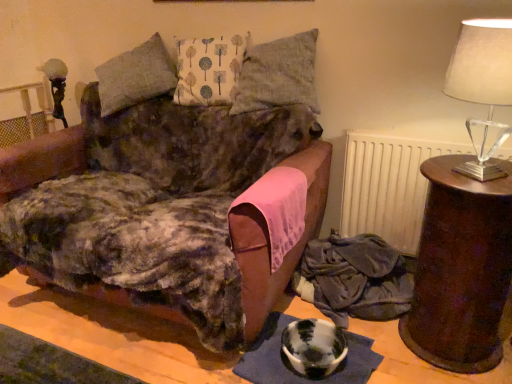
Question: Is velvet fabric blanket at lower right facing towards velvet brown couch at center?

Choices:
 (A) yes
 (B) no

Answer: (B)

Question: From a real-world perspective, is velvet fabric blanket at lower right located higher than velvet brown couch at center?

Choices:
 (A) yes
 (B) no

Answer: (B)

Question: From the image's perspective, is velvet fabric blanket at lower right over velvet brown couch at center?

Choices:
 (A) no
 (B) yes

Answer: (A)

Question: Is velvet fabric blanket at lower right smaller than velvet brown couch at center?

Choices:
 (A) no
 (B) yes

Answer: (B)

Question: Does velvet fabric blanket at lower right have a lesser height compared to velvet brown couch at center?

Choices:
 (A) no
 (B) yes

Answer: (B)

Question: In terms of height, does translucent glass lampshade at right look taller or shorter compared to white printed cushion at center, placed as the first pillow when sorted from left to right?

Choices:
 (A) tall
 (B) short

Answer: (A)

Question: In the image, is translucent glass lampshade at right positioned in front of or behind white printed cushion at center, placed as the first pillow when sorted from left to right?

Choices:
 (A) front
 (B) behind

Answer: (A)

Question: From a real-world perspective, is translucent glass lampshade at right above or below white printed cushion at center, the 2th pillow from the right?

Choices:
 (A) above
 (B) below

Answer: (B)

Question: Would you say translucent glass lampshade at right is to the left or to the right of white printed cushion at center, the 2th pillow from the right, in the picture?

Choices:
 (A) right
 (B) left

Answer: (A)

Question: Does point (251, 119) appear closer or farther from the camera than point (207, 49)?

Choices:
 (A) closer
 (B) farther

Answer: (A)

Question: In the image, is velvet brown couch at center on the left side or the right side of white printed cushion at center, placed as the first pillow when sorted from left to right?

Choices:
 (A) right
 (B) left

Answer: (B)

Question: Is velvet brown couch at center situated inside white printed cushion at center, placed as the first pillow when sorted from left to right, or outside?

Choices:
 (A) inside
 (B) outside

Answer: (B)

Question: Considering their positions, is velvet brown couch at center located in front of or behind white printed cushion at center, the 2th pillow from the right?

Choices:
 (A) front
 (B) behind

Answer: (A)

Question: Based on their positions, is velvet brown couch at center located to the left or right of translucent glass lampshade at right?

Choices:
 (A) right
 (B) left

Answer: (B)

Question: From a real-world perspective, is velvet brown couch at center above or below translucent glass lampshade at right?

Choices:
 (A) below
 (B) above

Answer: (A)